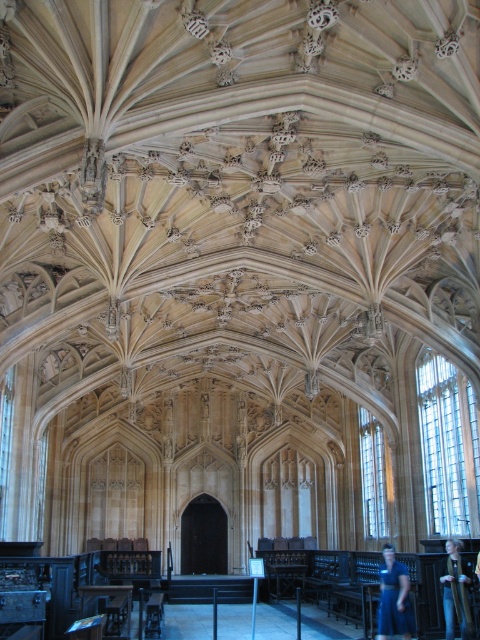
Question: Which point is farther from the camera taking this photo?

Choices:
 (A) (463, 584)
 (B) (384, 563)

Answer: (B)

Question: Among these points, which one is nearest to the camera?

Choices:
 (A) (386, 620)
 (B) (451, 579)

Answer: (A)

Question: Is the position of blue fabric at center more distant than that of dark blue fabric at center?

Choices:
 (A) yes
 (B) no

Answer: (A)

Question: Observing the image, what is the correct spatial positioning of blue fabric at center in reference to dark blue fabric at center?

Choices:
 (A) above
 (B) below

Answer: (B)

Question: Is blue fabric at center wider than dark blue fabric at center?

Choices:
 (A) yes
 (B) no

Answer: (A)